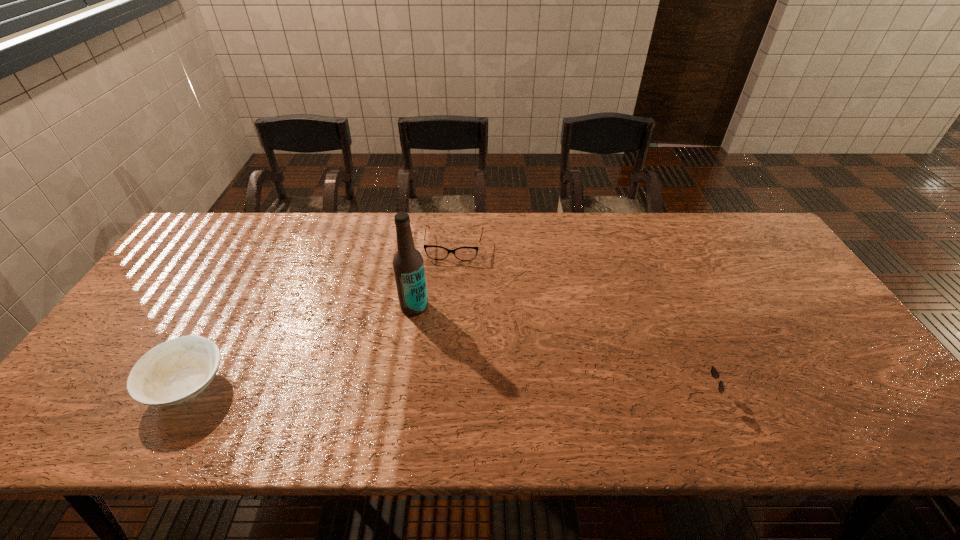
Find the location of a particular element. Image resolution: width=960 pixels, height=540 pixels. vacant spot on the desktop that is between the leftmost object and the sunglasses and is positioned on the front-facing side of the farthest object is located at coordinates (432, 390).

Find the location of a particular element. Image resolution: width=960 pixels, height=540 pixels. free spot on the desktop that is between the leftmost object and the sunglasses and is positioned on the label of the beer bottle is located at coordinates (366, 389).